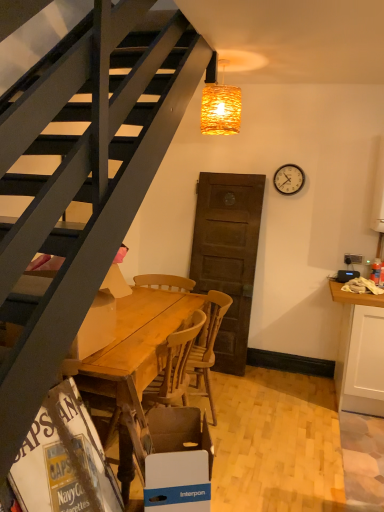
Where is `wooden table at center`? This screenshot has height=512, width=384. wooden table at center is located at coordinates (140, 340).

What is the approximate width of translucent plastic bottle at right?

translucent plastic bottle at right is 3.60 inches wide.

Identify the location of translucent plastic bottle at right. The width and height of the screenshot is (384, 512). (x=376, y=271).

Describe the element at coordinates (64, 460) in the screenshot. I see `white cardboard magazine at lower left` at that location.

Image resolution: width=384 pixels, height=512 pixels. I want to click on woven wicker lampshade at upper center, so click(219, 104).

Image resolution: width=384 pixels, height=512 pixels. What do you see at coordinates (219, 104) in the screenshot?
I see `woven wicker lampshade at upper center` at bounding box center [219, 104].

The height and width of the screenshot is (512, 384). In order to click on blue cardboard box at lower center, the 1th box from the bottom in this screenshot , I will do `click(178, 458)`.

The image size is (384, 512). Describe the element at coordinates (289, 179) in the screenshot. I see `metallic round clock at upper right` at that location.

What is the approximate width of wooden at center?

wooden at center is 22.82 inches in width.

Image resolution: width=384 pixels, height=512 pixels. I want to click on wooden table at center, so click(140, 340).

From a real-world perspective, is wooden table at lower left, marked as the second box in a bottom-to-top arrangement, positioned under white cardboard magazine at lower left based on gravity?

No, from a real-world perspective, wooden table at lower left, marked as the second box in a bottom-to-top arrangement, is not below white cardboard magazine at lower left.

Which object is closer to the camera, wooden table at lower left, the first box in the top-to-bottom sequence, or white cardboard magazine at lower left?

white cardboard magazine at lower left.

From the white cardboard magazine at lower left, count 2nd boxs backward and point to it. Please provide its 2D coordinates.

[(100, 316)]

Is point (87, 336) positioned behind point (38, 475)?

Yes, it is.

From the image's perspective, is white cardboard magazine at lower left under blue cardboard box at lower center, positioned as the second box in left-to-right order?

No, from the image's perspective, white cardboard magazine at lower left is not beneath blue cardboard box at lower center, positioned as the second box in left-to-right order.

Based on the photo, is white cardboard magazine at lower left next to blue cardboard box at lower center, the 1th box from the bottom?

No, white cardboard magazine at lower left is not with blue cardboard box at lower center, the 1th box from the bottom.

From a real-world perspective, who is located higher, white cardboard magazine at lower left or blue cardboard box at lower center, the 2th box in the top-to-bottom sequence?

white cardboard magazine at lower left.

Who is shorter, wooden table at lower left, the second box positioned from the right, or woven wicker lampshade at upper center?

Standing shorter between the two is woven wicker lampshade at upper center.

Between wooden table at lower left, the second box positioned from the right, and woven wicker lampshade at upper center, which one has larger size?

wooden table at lower left, the second box positioned from the right.

Is wooden table at lower left, marked as the first box in a left-to-right arrangement, facing towards woven wicker lampshade at upper center?

No.

This screenshot has height=512, width=384. Find the location of `box that is the 1st one when counting downward from the woven wicker lampshade at upper center (from the image's perspective)`. box that is the 1st one when counting downward from the woven wicker lampshade at upper center (from the image's perspective) is located at coordinates (100, 316).

Is woven wicker lampshade at upper center a part of translucent plastic bottle at right?

No, translucent plastic bottle at right does not contain woven wicker lampshade at upper center.

From the image's perspective, which one is positioned lower, translucent plastic bottle at right or woven wicker lampshade at upper center?

translucent plastic bottle at right, from the image's perspective.

In the scene shown: Is translucent plastic bottle at right wider than woven wicker lampshade at upper center?

In fact, translucent plastic bottle at right might be narrower than woven wicker lampshade at upper center.

Is white cardboard magazine at lower left to the left of wooden table at center from the viewer's perspective?

Yes, white cardboard magazine at lower left is to the left of wooden table at center.

How many degrees apart are the facing directions of white cardboard magazine at lower left and wooden table at center?

There is a 176-degree angle between the facing directions of white cardboard magazine at lower left and wooden table at center.

Does white cardboard magazine at lower left turn towards wooden table at center?

No, white cardboard magazine at lower left does not turn towards wooden table at center.

The height and width of the screenshot is (512, 384). In order to click on desk above the white cardboard magazine at lower left (from the image's perspective) in this screenshot , I will do `click(140, 340)`.

Does translucent plastic bottle at right have a lesser width compared to wooden table at center?

Yes.

Who is taller, translucent plastic bottle at right or wooden table at center?

wooden table at center.

Who is bigger, translucent plastic bottle at right or wooden table at lower left, the first box in the top-to-bottom sequence?

With larger size is wooden table at lower left, the first box in the top-to-bottom sequence.

Does translucent plastic bottle at right lie in front of wooden table at lower left, marked as the first box in a left-to-right arrangement?

No, the depth of translucent plastic bottle at right is greater than that of wooden table at lower left, marked as the first box in a left-to-right arrangement.

Between translucent plastic bottle at right and wooden table at lower left, the first box in the top-to-bottom sequence, which one has smaller width?

translucent plastic bottle at right is thinner.

Identify the location of box that is the 2nd object located behind the white cardboard magazine at lower left. The height and width of the screenshot is (512, 384). point(100,316).

You are a GUI agent. You are given a task and a screenshot of the screen. Output one action in this format:
    pyautogui.click(x=<x>, y=<y>)
    Task: Click on the magazine in front of the blue cardboard box at lower center, the 1th box from the right
    The width and height of the screenshot is (384, 512).
    Given the screenshot: What is the action you would take?
    pyautogui.click(x=64, y=460)

From the image, which object appears to be farther from translucent plastic bottle at right, wooden at center or blue cardboard box at lower center, positioned as the second box in left-to-right order?

blue cardboard box at lower center, positioned as the second box in left-to-right order, is further to translucent plastic bottle at right.

From the image, which object appears to be farther from woven wicker lampshade at upper center, translucent plastic bottle at right or wooden at center?

translucent plastic bottle at right is positioned further to the anchor woven wicker lampshade at upper center.

Based on their spatial positions, is wooden table at center or wooden table at lower left, marked as the second box in a bottom-to-top arrangement, closer to wooden at center?

The object closer to wooden at center is wooden table at center.

Based on their spatial positions, is woven wicker lampshade at upper center or wooden table at center further from wooden table at lower left, the first box in the top-to-bottom sequence?

The object further to wooden table at lower left, the first box in the top-to-bottom sequence, is woven wicker lampshade at upper center.

From the picture: From the image, which object appears to be nearer to wooden table at lower left, marked as the first box in a left-to-right arrangement, metallic round clock at upper right or woven wicker lampshade at upper center?

woven wicker lampshade at upper center lies closer to wooden table at lower left, marked as the first box in a left-to-right arrangement, than the other object.

Based on their spatial positions, is white cardboard magazine at lower left or woven wicker lampshade at upper center closer to metallic round clock at upper right?

woven wicker lampshade at upper center lies closer to metallic round clock at upper right than the other object.

Which object lies nearer to the anchor point blue cardboard box at lower center, positioned as the second box in left-to-right order, metallic round clock at upper right or wooden table at lower left, the first box in the top-to-bottom sequence?

Based on the image, wooden table at lower left, the first box in the top-to-bottom sequence, appears to be nearer to blue cardboard box at lower center, positioned as the second box in left-to-right order.

Considering their positions, is wooden table at center positioned further to metallic round clock at upper right than blue cardboard box at lower center, the 1th box from the right?

The object further to metallic round clock at upper right is blue cardboard box at lower center, the 1th box from the right.

You are a GUI agent. You are given a task and a screenshot of the screen. Output one action in this format:
    pyautogui.click(x=<x>, y=<y>)
    Task: Click on the clock between woven wicker lampshade at upper center and wooden table at center vertically
    This screenshot has height=512, width=384.
    Given the screenshot: What is the action you would take?
    pos(289,179)

The image size is (384, 512). I want to click on bottle between woven wicker lampshade at upper center and blue cardboard box at lower center, the 1th box from the right, from top to bottom, so click(376, 271).

You are a GUI agent. You are given a task and a screenshot of the screen. Output one action in this format:
    pyautogui.click(x=<x>, y=<y>)
    Task: Click on the lamp between wooden table at lower left, marked as the second box in a bottom-to-top arrangement, and translucent plastic bottle at right, in the horizontal direction
    This screenshot has width=384, height=512.
    Given the screenshot: What is the action you would take?
    pyautogui.click(x=219, y=104)

Where is `desk that lies between woven wicker lampshade at upper center and white cardboard magazine at lower left from top to bottom`? The image size is (384, 512). desk that lies between woven wicker lampshade at upper center and white cardboard magazine at lower left from top to bottom is located at coordinates [140, 340].